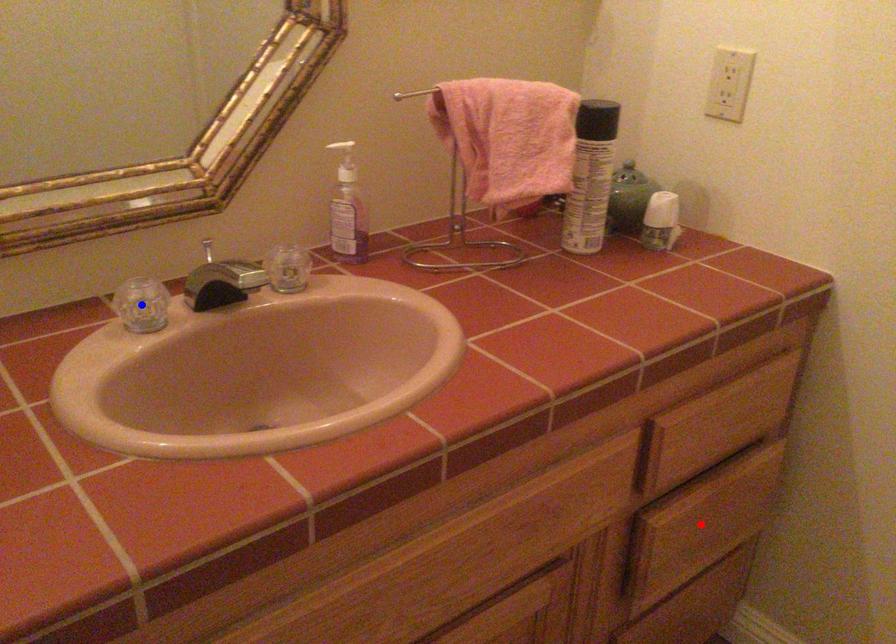
Question: In the image, two points are highlighted. Which point is nearer to the camera? Reply with the corresponding letter.

Choices:
 (A) blue point
 (B) red point

Answer: (A)